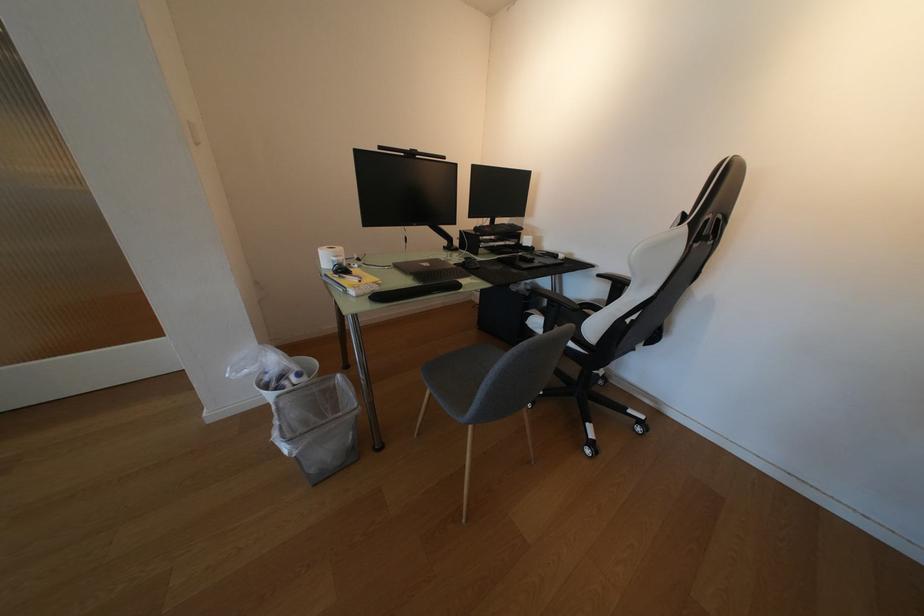
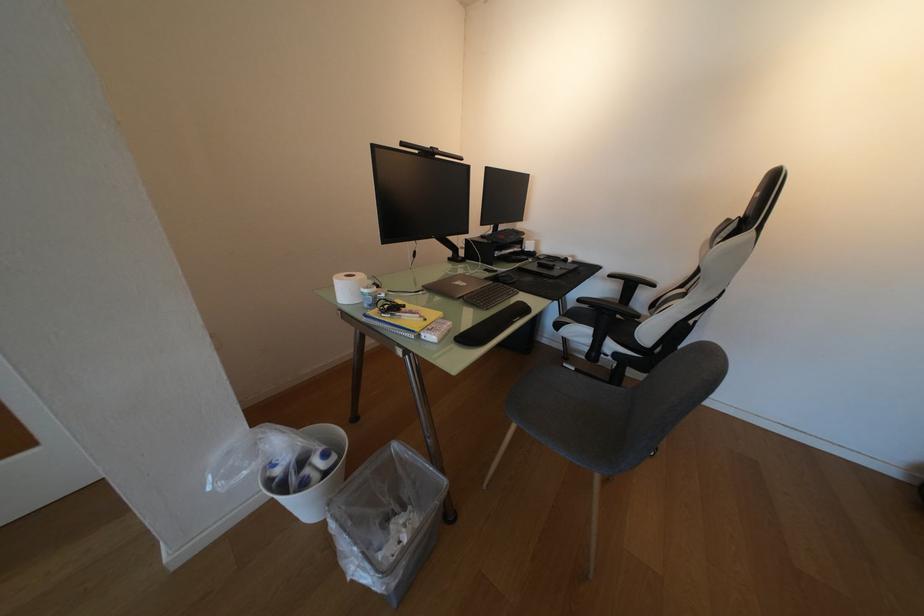
Question: How did the camera likely rotate?

Choices:
 (A) Left
 (B) Right
 (C) Up
 (D) Down

Answer: (B)